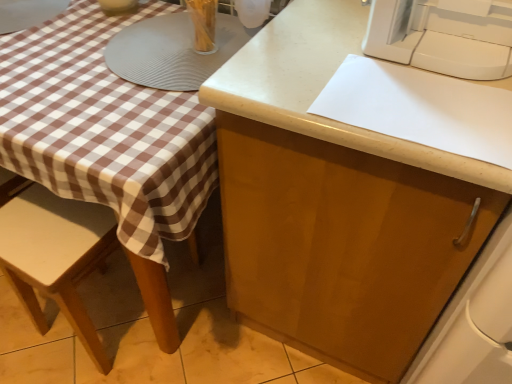
This screenshot has width=512, height=384. I want to click on vacant area that is in front of white plastic sewing machine at upper right, so (x=426, y=109).